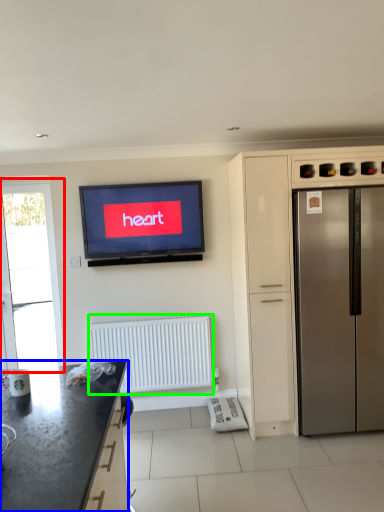
Question: Which object is positioned closest to window screen (highlighted by a red box)? Select from countertop (highlighted by a blue box) and radiator (highlighted by a green box).

Choices:
 (A) countertop
 (B) radiator

Answer: (B)